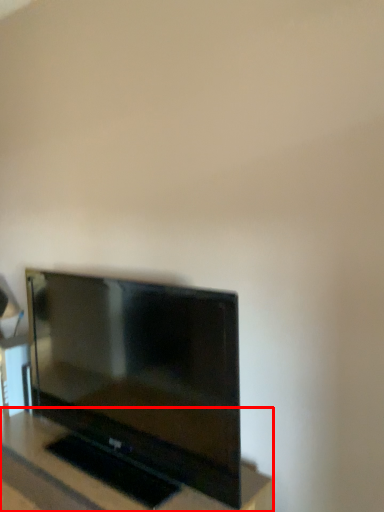
Question: From the image, what is the correct spatial relationship of furniture (annotated by the red box) in relation to television?

Choices:
 (A) left
 (B) right

Answer: (A)